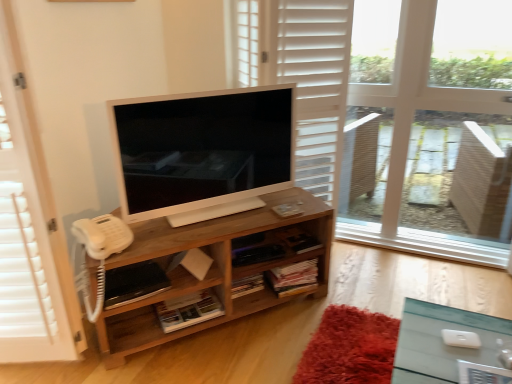
Question: Is satin white television at center to the left of woodenobject at center from the viewer's perspective?

Choices:
 (A) yes
 (B) no

Answer: (B)

Question: Is satin white television at center behind woodenobject at center?

Choices:
 (A) yes
 (B) no

Answer: (B)

Question: Are satin white television at center and woodenobject at center far apart?

Choices:
 (A) no
 (B) yes

Answer: (A)

Question: Is woodenobject at center at the back of satin white television at center?

Choices:
 (A) yes
 (B) no

Answer: (B)

Question: Could woodenobject at center be considered to be inside satin white television at center?

Choices:
 (A) yes
 (B) no

Answer: (B)

Question: Considering the relative positions of satin white television at center and white wooden screen door at left in the image provided, is satin white television at center to the left or to the right of white wooden screen door at left?

Choices:
 (A) left
 (B) right

Answer: (B)

Question: In terms of size, does satin white television at center appear bigger or smaller than white wooden screen door at left?

Choices:
 (A) big
 (B) small

Answer: (B)

Question: From the image's perspective, is satin white television at center positioned above or below white wooden screen door at left?

Choices:
 (A) above
 (B) below

Answer: (A)

Question: Looking at their shapes, would you say satin white television at center is wider or thinner than white wooden screen door at left?

Choices:
 (A) wide
 (B) thin

Answer: (B)

Question: Based on their sizes in the image, would you say satin white television at center is bigger or smaller than woodenobject at center?

Choices:
 (A) small
 (B) big

Answer: (A)

Question: Considering the positions of satin white television at center and woodenobject at center in the image, is satin white television at center wider or thinner than woodenobject at center?

Choices:
 (A) wide
 (B) thin

Answer: (B)

Question: Considering the relative positions of satin white television at center and woodenobject at center in the image provided, is satin white television at center to the left or to the right of woodenobject at center?

Choices:
 (A) left
 (B) right

Answer: (B)

Question: From a real-world perspective, is satin white television at center positioned above or below woodenobject at center?

Choices:
 (A) below
 (B) above

Answer: (B)

Question: From their relative heights in the image, would you say woodenobject at center is taller or shorter than white wood window frame at upper right?

Choices:
 (A) short
 (B) tall

Answer: (A)

Question: From the image's perspective, is woodenobject at center located above or below white wood window frame at upper right?

Choices:
 (A) above
 (B) below

Answer: (B)